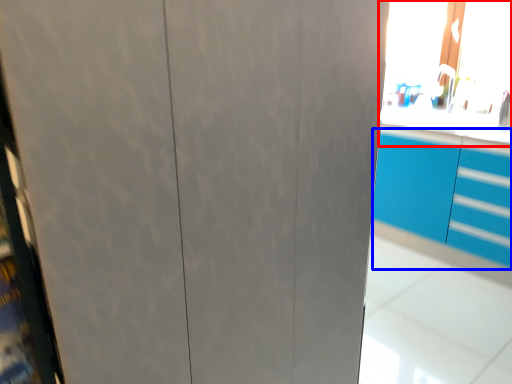
Question: Which point is further to the camera, window screen (highlighted by a red box) or cabinetry (highlighted by a blue box)?

Choices:
 (A) window screen
 (B) cabinetry

Answer: (A)